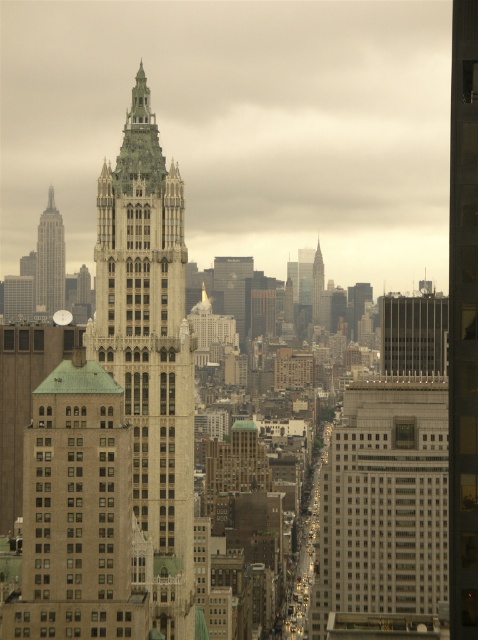
Question: Which of the following is the closest to the observer?

Choices:
 (A) (318, 253)
 (B) (63, 250)

Answer: (A)

Question: Considering the real-world distances, which object is farthest from the green glass skyscraper at center?

Choices:
 (A) green stone tower at center
 (B) matte silver sphere at center
 (C) brown brick building at center

Answer: (C)

Question: Is green stone tower at center to the right of matte silver sphere at center from the viewer's perspective?

Choices:
 (A) yes
 (B) no

Answer: (A)

Question: Does matte silver sphere at center have a lesser width compared to green glass skyscraper at center?

Choices:
 (A) yes
 (B) no

Answer: (B)

Question: Can you confirm if brown brick building at center is smaller than green glass skyscraper at center?

Choices:
 (A) no
 (B) yes

Answer: (A)

Question: Which point is farther to the camera?

Choices:
 (A) (43, 307)
 (B) (30, 436)

Answer: (A)